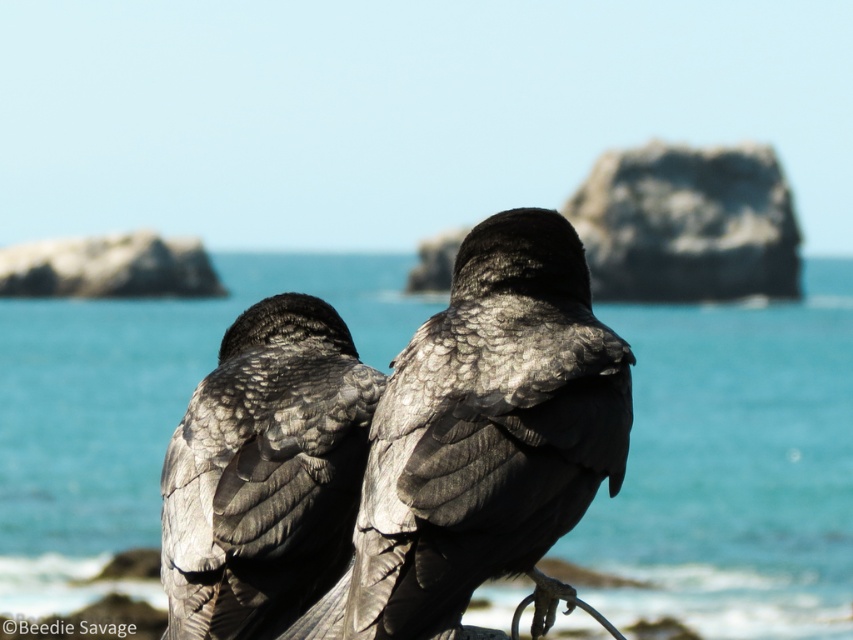
Question: Is blue water at center positioned behind gray textured feathers at center?

Choices:
 (A) yes
 (B) no

Answer: (B)

Question: Is blue water at center behind gray textured feathers at center?

Choices:
 (A) no
 (B) yes

Answer: (A)

Question: Which point is closer to the camera?

Choices:
 (A) shiny black raven at center
 (B) blue water at center
 (C) gray textured feathers at center

Answer: (A)

Question: Which point appears farthest from the camera in this image?

Choices:
 (A) pos(202,451)
 (B) pos(485,435)
 (C) pos(763,353)

Answer: (C)

Question: Which object is the farthest from the shiny black raven at center?

Choices:
 (A) blue water at center
 (B) gray textured feathers at center

Answer: (A)

Question: In this image, where is shiny black raven at center located relative to gray textured feathers at center?

Choices:
 (A) above
 (B) below

Answer: (B)